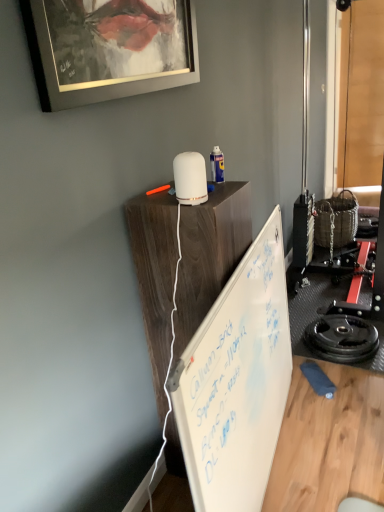
Identify the location of vacant space situated on the left part of white matte diffuser at upper center. (152, 202).